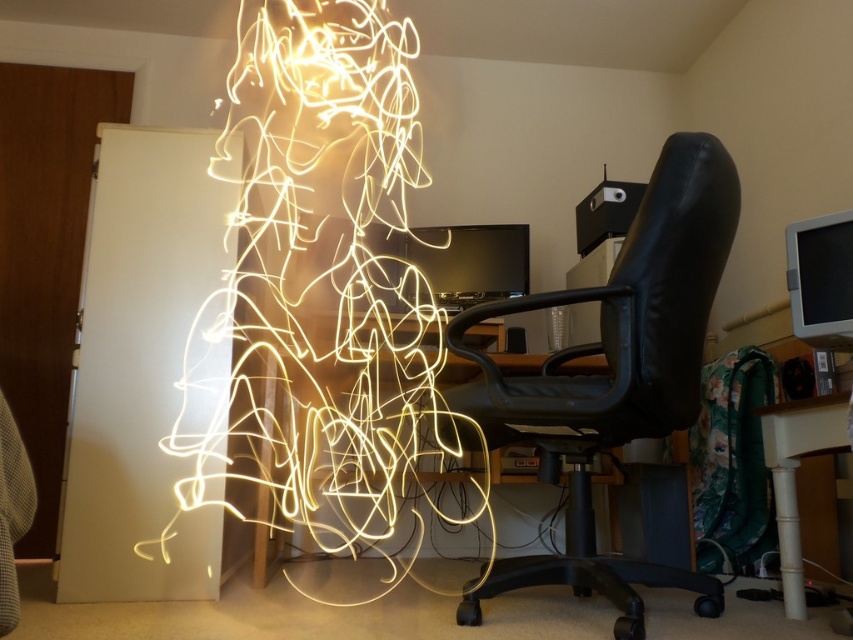
Question: Which of the following is the closest to the observer?

Choices:
 (A) white glossy table at lower right
 (B) black leather swivel chair at center

Answer: (B)

Question: Is black leather swivel chair at center above white glossy table at lower right?

Choices:
 (A) no
 (B) yes

Answer: (B)

Question: Where is black leather swivel chair at center located in relation to white glossy table at lower right in the image?

Choices:
 (A) above
 (B) below

Answer: (A)

Question: Can you confirm if black leather swivel chair at center is smaller than white glossy table at lower right?

Choices:
 (A) yes
 (B) no

Answer: (B)